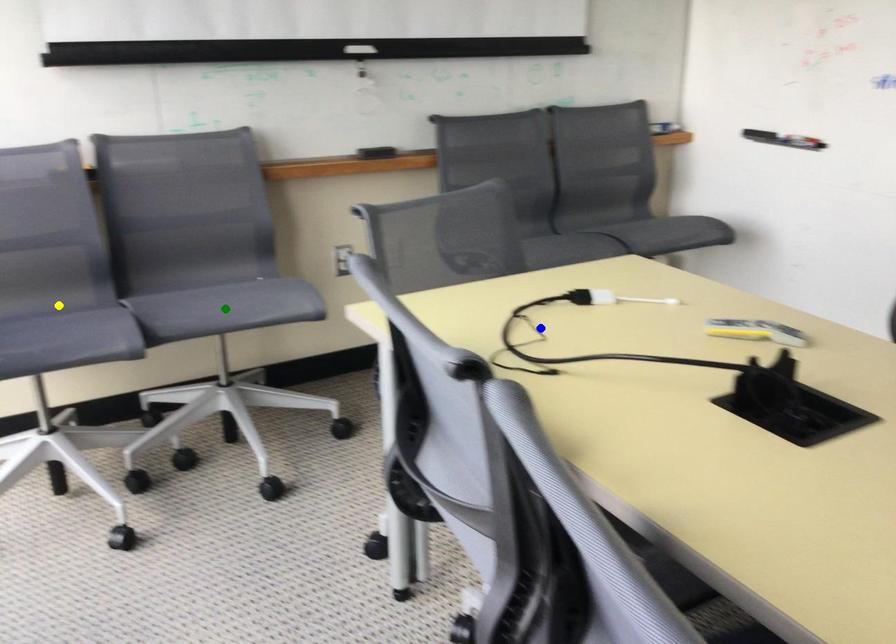
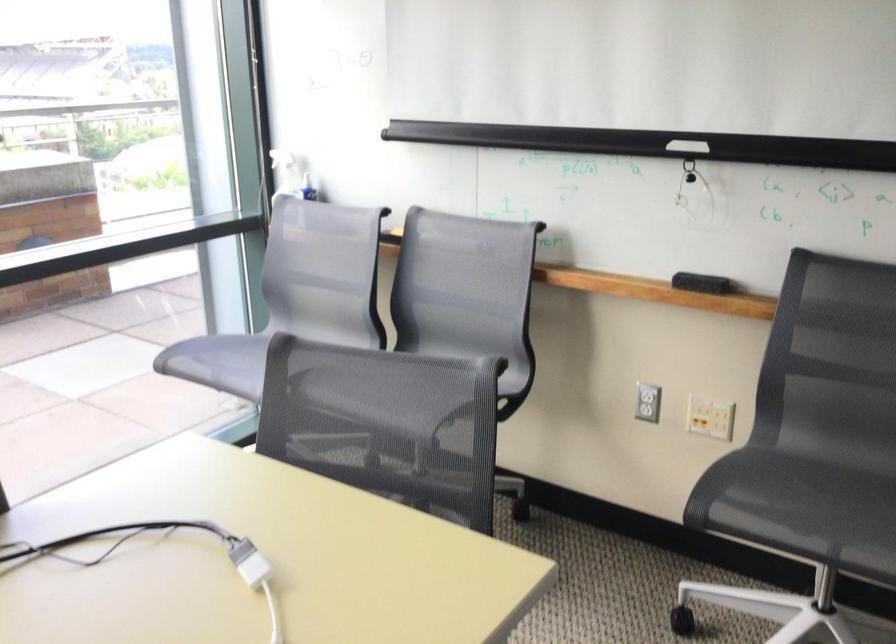
I am providing you with two images of the same scene from different viewpoints. Three points are marked in image1. Which point corresponds to a part or object that is occluded in image2?In image1, three points are marked. Which of them correspond to a part or object that is occluded in image2?Among the three points shown in image1, which one corresponds to a part or object that is no longer visible due to occlusion in image2?

yellow point, green point cannot be seen in image2.